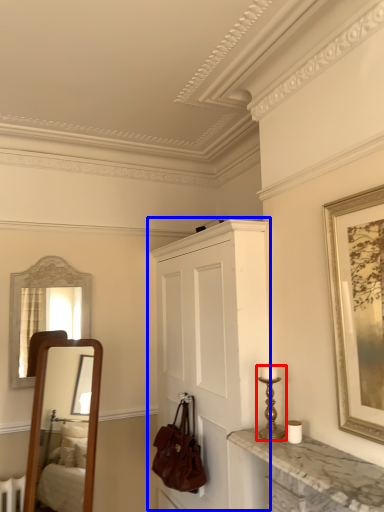
Question: Which of the following is the closest to the observer, candle holder (highlighted by a red box) or cabinetry (highlighted by a blue box)?

Choices:
 (A) candle holder
 (B) cabinetry

Answer: (A)